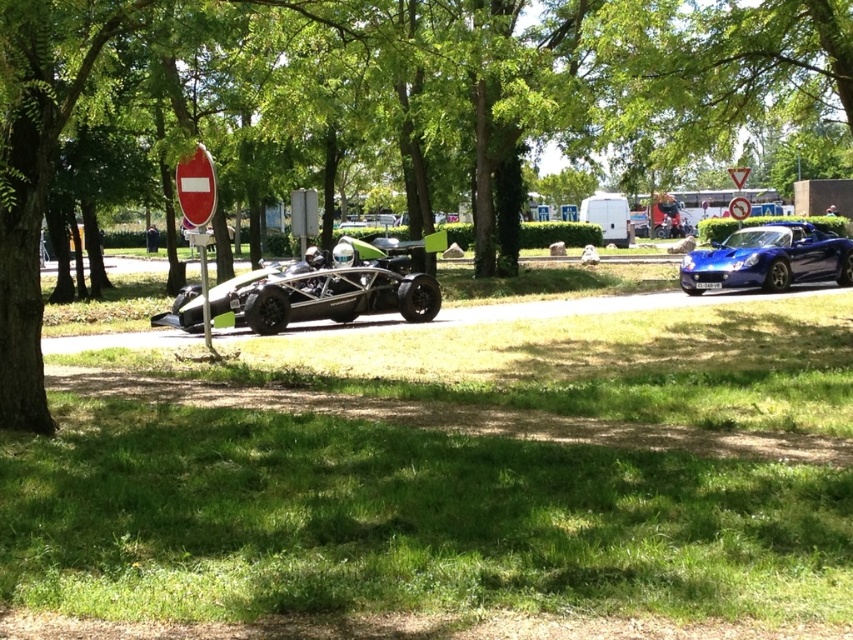
From the picture: Between shiny silver sports car at center and shiny blue car at center, which one appears on the right side from the viewer's perspective?

shiny blue car at center

This screenshot has height=640, width=853. What are the coordinates of `shiny silver sports car at center` in the screenshot? It's located at (334, 288).

This screenshot has width=853, height=640. I want to click on shiny silver sports car at center, so click(x=334, y=288).

Does shiny silver sports car at center appear on the left side of glossy blue sports car at right?

Indeed, shiny silver sports car at center is positioned on the left side of glossy blue sports car at right.

You are a GUI agent. You are given a task and a screenshot of the screen. Output one action in this format:
    pyautogui.click(x=<x>, y=<y>)
    Task: Click on the shiny silver sports car at center
    The image size is (853, 640).
    Given the screenshot: What is the action you would take?
    pyautogui.click(x=334, y=288)

Is point (840, 376) in front of point (386, 278)?

Yes, it is in front of point (386, 278).

Who is taller, green grass at lower center or shiny silver sports car at center?

green grass at lower center

Which is behind, point (306, 554) or point (242, 296)?

Point (242, 296)

I want to click on green grass at lower center, so (x=399, y=522).